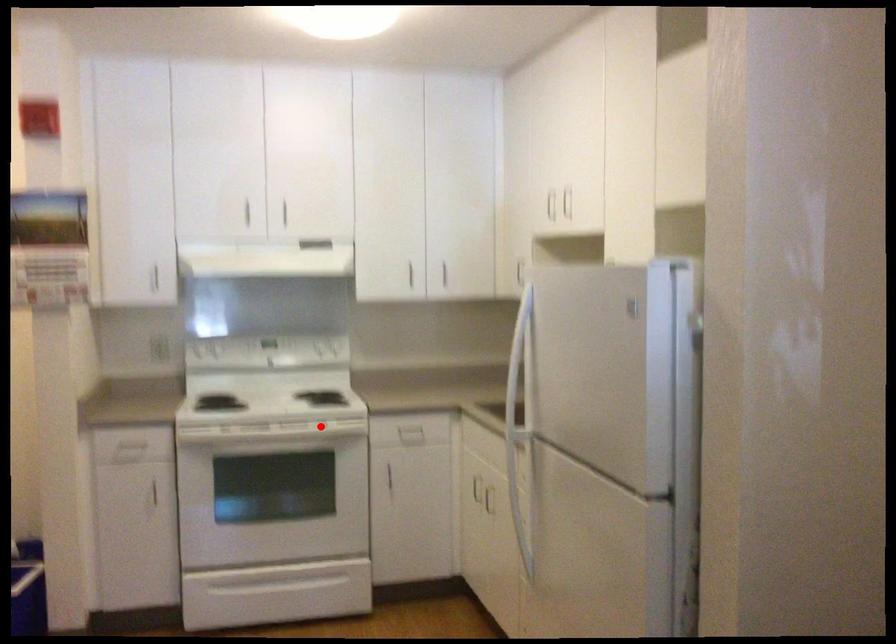
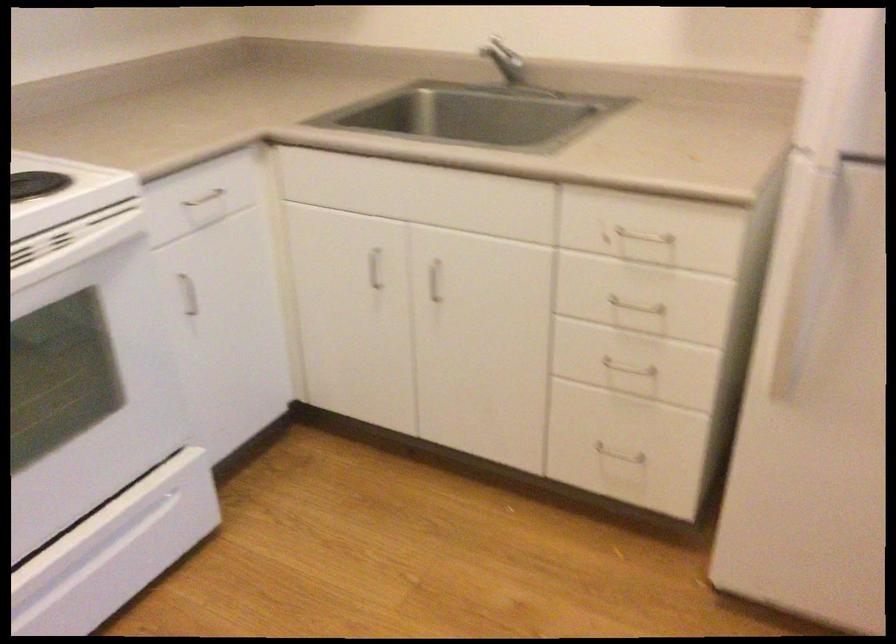
Question: I am providing you with two images of the same scene from different viewpoints. Given a red point in image1, look at the same physical point in image2. Is it:

Choices:
 (A) Closer to the viewpoint
 (B) Farther from the viewpoint

Answer: (A)